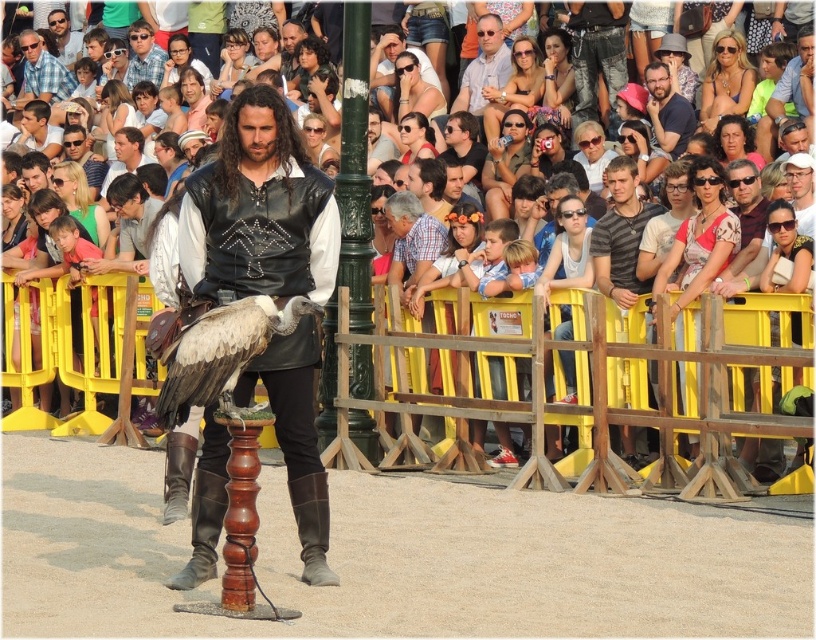
Question: Considering the real-world distances, which object is closest to the white feathered eagle at center?

Choices:
 (A) matte blue shirt at upper right
 (B) plaid shirt at center

Answer: (B)

Question: Observing the image, what is the correct spatial positioning of leather vest at center in reference to white feathered eagle at center?

Choices:
 (A) right
 (B) left

Answer: (A)

Question: Where is plaid shirt at center located in relation to matte black sunglasses at upper center in the image?

Choices:
 (A) above
 (B) below

Answer: (B)

Question: Can you confirm if plaid shirt at center is positioned above light blue plaid shirt at upper left?

Choices:
 (A) no
 (B) yes

Answer: (A)

Question: Which of these objects is positioned farthest from the striped cotton shirt at center?

Choices:
 (A) plaid shirt at center
 (B) light blue plaid shirt at upper left
 (C) matte blue shirt at upper right

Answer: (B)

Question: Which of these objects is positioned farthest from the light blue plaid shirt at upper left?

Choices:
 (A) matte black sunglasses at upper center
 (B) leather vest at center
 (C) matte blue shirt at upper right
 (D) white feathered eagle at center

Answer: (B)